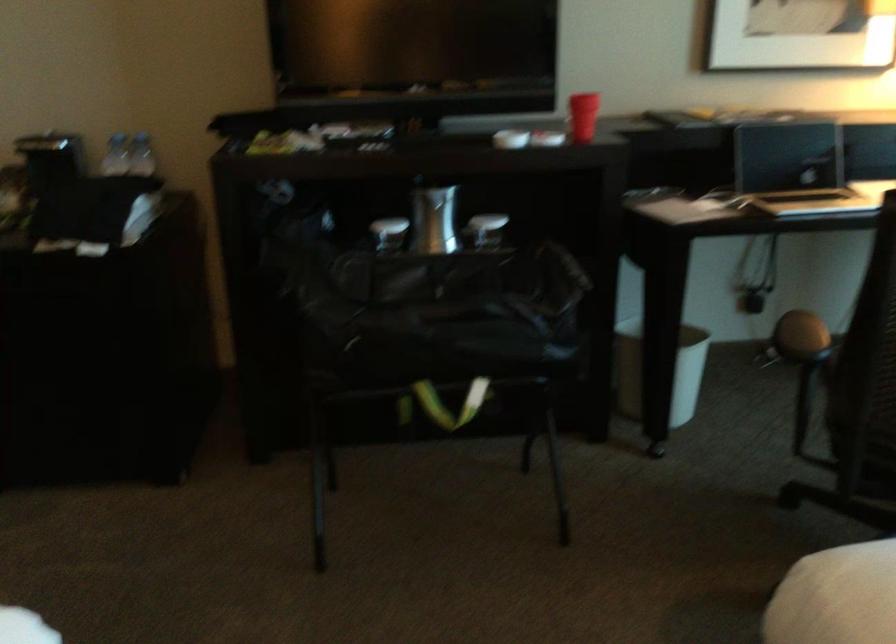
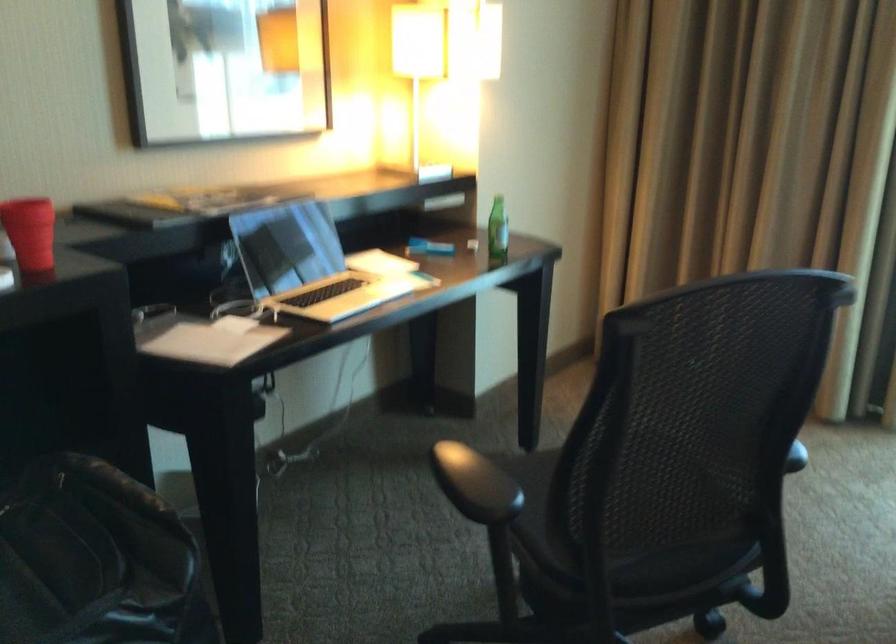
Question: Based on the continuous images, in which direction is the camera rotating? Reply with the corresponding letter.

Choices:
 (A) Left
 (B) Right
 (C) Up
 (D) Down

Answer: (B)